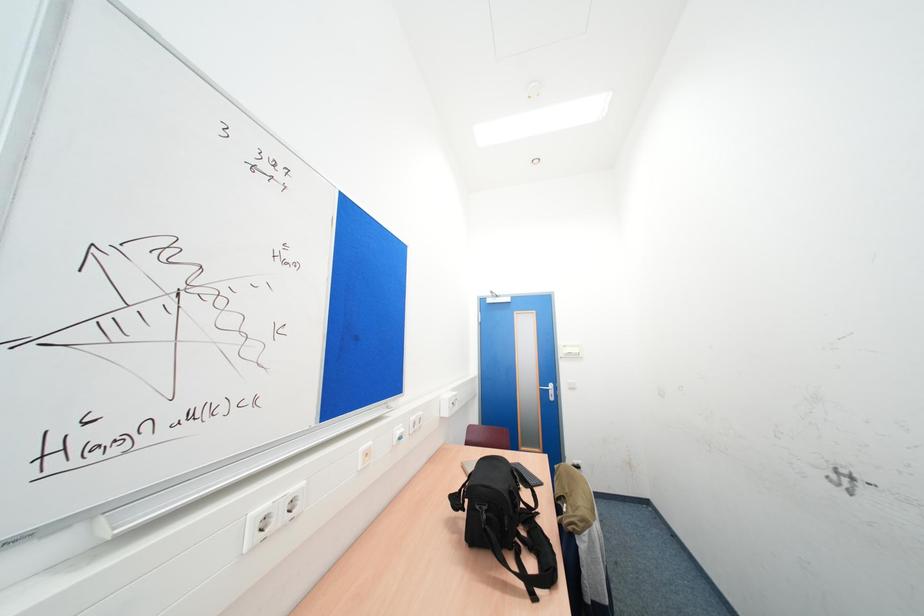
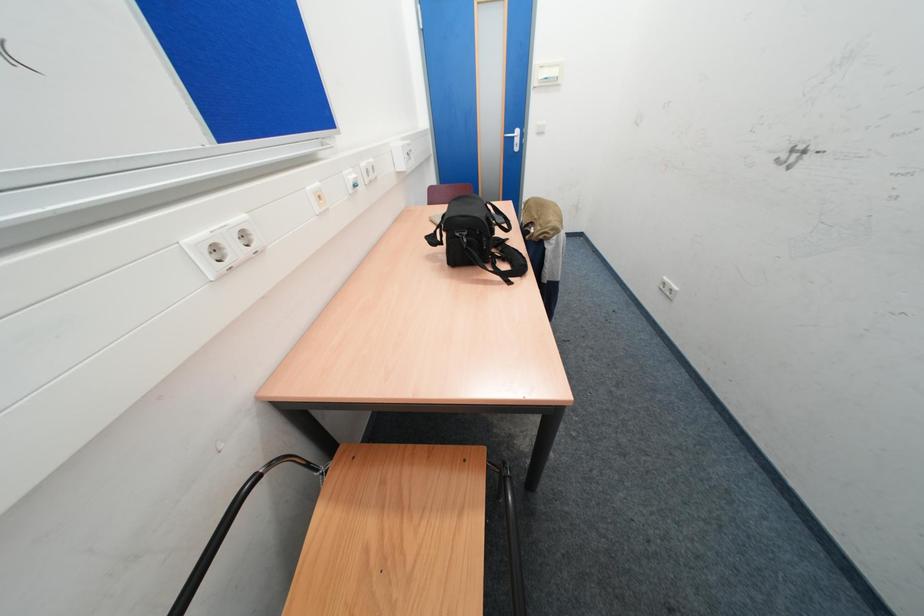
Question: How did the camera likely rotate?

Choices:
 (A) Left
 (B) Right
 (C) Up
 (D) Down

Answer: (D)